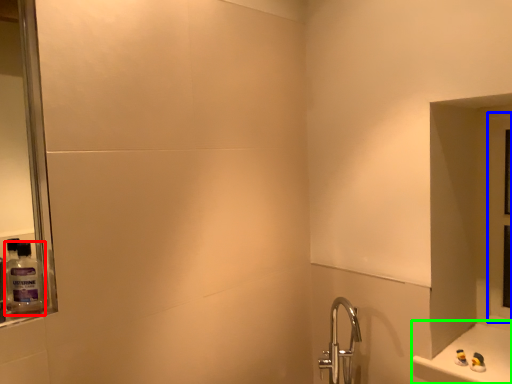
Question: Which object is the closest to the mouthwash (highlighted by a red box)? Choose among these: glass door (highlighted by a blue box) or counter (highlighted by a green box).

Choices:
 (A) glass door
 (B) counter

Answer: (B)